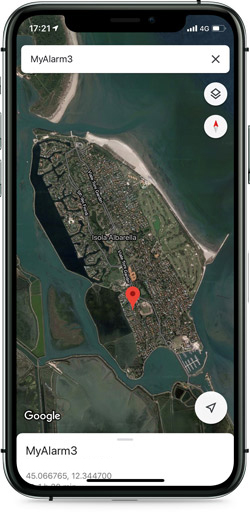
Identify the location of black border around screen. (64, 487), (184, 488), (236, 400), (15, 405), (28, 13), (15, 161), (236, 138), (228, 17).